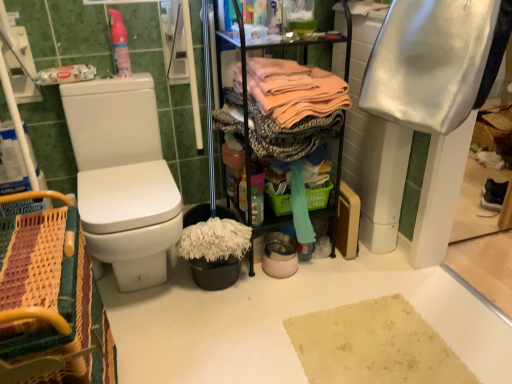
Question: Which direction should I rotate to look at pink fabric at center, marked as the second clothing in a right-to-left arrangement, — up or down?

Choices:
 (A) down
 (B) up

Answer: (B)

Question: Is woven wood picnic basket at lower left inside white glossy toilet at left?

Choices:
 (A) no
 (B) yes

Answer: (A)

Question: Does white glossy toilet at left turn towards woven wood picnic basket at lower left?

Choices:
 (A) yes
 (B) no

Answer: (B)

Question: Does white glossy toilet at left have a lesser height compared to woven wood picnic basket at lower left?

Choices:
 (A) yes
 (B) no

Answer: (B)

Question: Can you confirm if white glossy toilet at left is thinner than woven wood picnic basket at lower left?

Choices:
 (A) no
 (B) yes

Answer: (A)

Question: Is white glossy toilet at left positioned before woven wood picnic basket at lower left?

Choices:
 (A) yes
 (B) no

Answer: (B)

Question: Can you confirm if white glossy toilet at left is taller than woven wood picnic basket at lower left?

Choices:
 (A) yes
 (B) no

Answer: (A)

Question: Is woven wood picnic basket at lower left at the left side of pink matte spray bottle at upper left?

Choices:
 (A) no
 (B) yes

Answer: (B)

Question: From a real-world perspective, is woven wood picnic basket at lower left located beneath pink matte spray bottle at upper left?

Choices:
 (A) no
 (B) yes

Answer: (B)

Question: Is woven wood picnic basket at lower left wider than pink matte spray bottle at upper left?

Choices:
 (A) yes
 (B) no

Answer: (A)

Question: Does woven wood picnic basket at lower left have a lesser width compared to pink matte spray bottle at upper left?

Choices:
 (A) no
 (B) yes

Answer: (A)

Question: Does woven wood picnic basket at lower left have a greater height compared to pink matte spray bottle at upper left?

Choices:
 (A) no
 (B) yes

Answer: (B)

Question: From the image's perspective, would you say woven wood picnic basket at lower left is shown under pink matte spray bottle at upper left?

Choices:
 (A) yes
 (B) no

Answer: (A)

Question: From the image's perspective, does white glossy toilet at left appear higher than pink fabric at center, marked as the second clothing in a right-to-left arrangement?

Choices:
 (A) yes
 (B) no

Answer: (B)